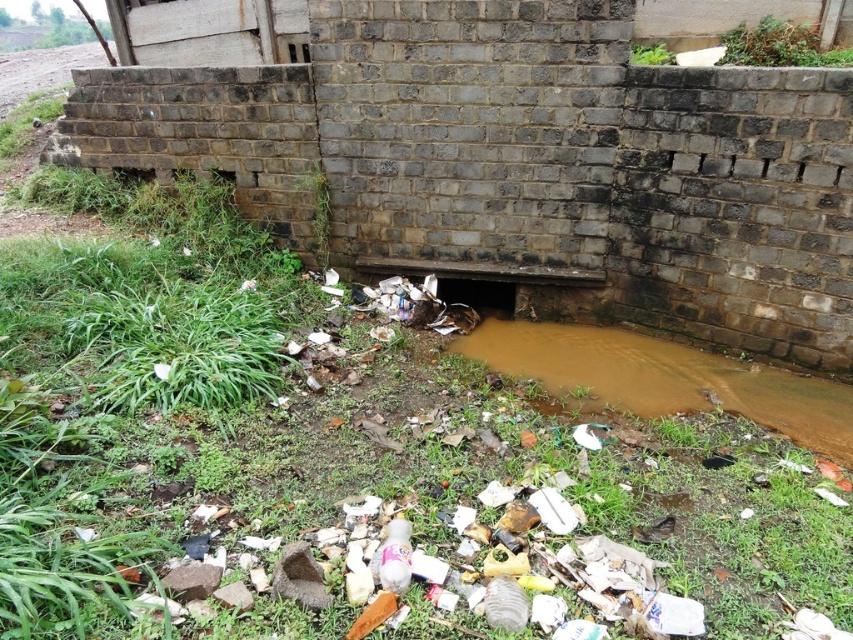
You are a maintenance worker tasked with assessing the drainage system. You notice the brown muddy stream at center and the black rubber hole at center. Which one is wider?

The brown muddy stream at center is wider than the black rubber hole at center.

You are a maintenance worker needing to inspect the brown muddy stream at center and the black rubber hole at center. Given that your inspection tool has a 30 inch reach, can you reach both objects without moving closer?

The brown muddy stream at center is 29.91 inches from the black rubber hole at center. Since the distance between them is less than the tool reach of 30 inches, you can reach both objects without moving closer.

Based on the photo, you are standing at the brick wall and looking towards the drainage channel. There are two points marked in the scene, point A at coordinates point A at (624, 378) and point B at (451, 294). Which point is closer to you?

Point B at (451, 294) is closer to you because it is behind point A at (624, 378), which is in front of it.